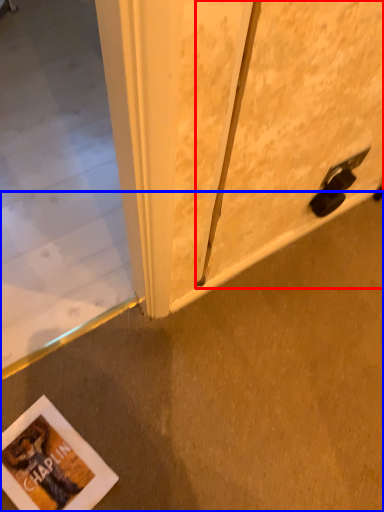
Question: Among these objects, which one is nearest to the camera, screen door (highlighted by a red box) or concrete (highlighted by a blue box)?

Choices:
 (A) screen door
 (B) concrete

Answer: (A)